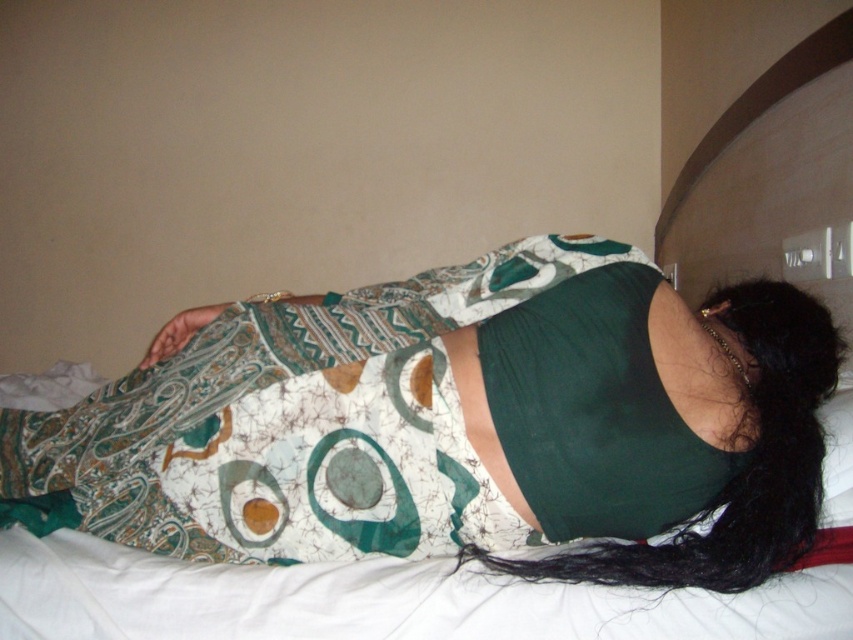
You are a photographer setting up a shoot in this room. You need to place a prop on the printed fabric dress at center so that it doesn not get covered by the black silky hair at center. Where should you position the prop?

The printed fabric dress at center is positioned under the black silky hair at center. To prevent the prop from being covered, place it on the printed fabric dress at center but outside the area directly beneath the black silky hair at center.

You are a fashion designer trying to create a new outfit. You see a printed fabric dress at center and a black silky hair at center in the image. Which item is bigger in size?

The printed fabric dress at center has a larger size compared to the black silky hair at center.

From the picture: You are standing in the room and want to reach the point marked as point (695, 484). If your arm can extend 36 inches, can you reach it without moving your feet?

The point (695, 484) is 38.72 inches away from you, which is beyond your arm extension of 36 inches. Therefore, you cannot reach it without moving your feet.